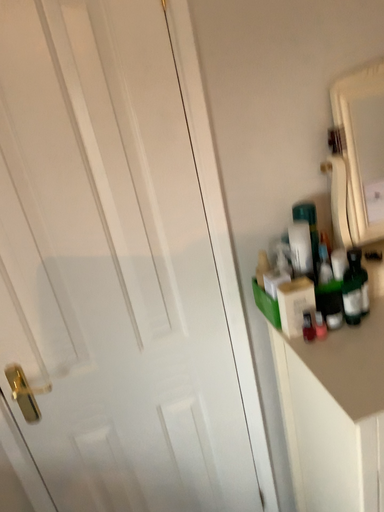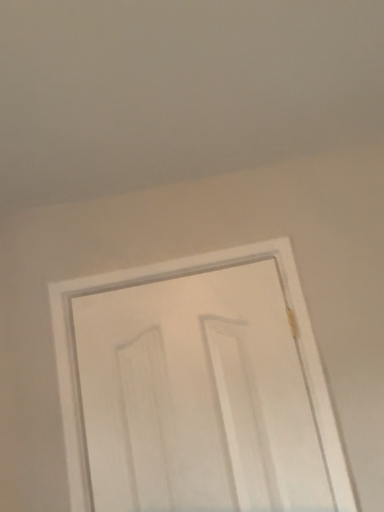
Question: Which way did the camera rotate in the video?

Choices:
 (A) rotated right
 (B) rotated left

Answer: (B)